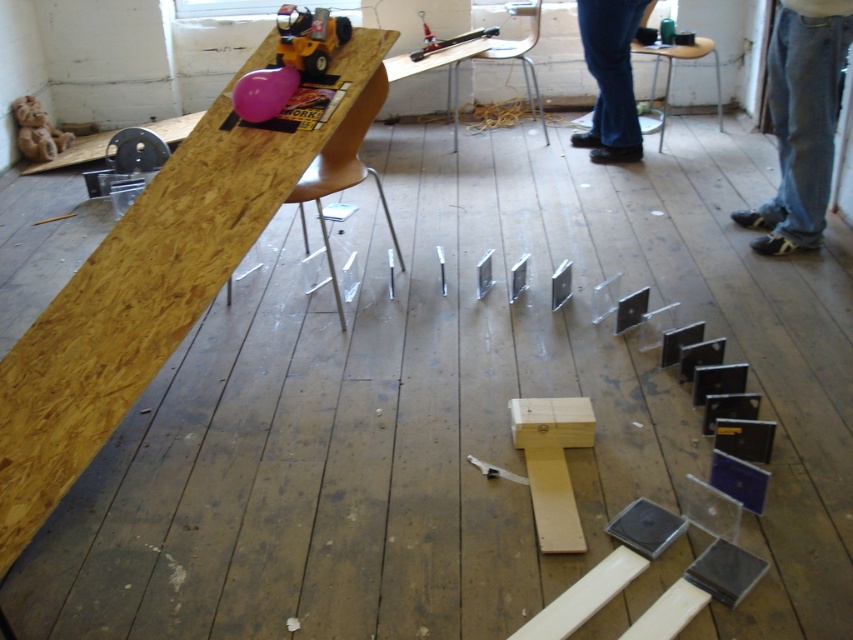
You are organizing items in a workshop and need to place the jeans at lower right and the brown leather stool at upper center. According to the scene, which item is positioned higher up in the image?

The jeans at lower right is located above the brown leather stool at upper center, so the jeans at lower right is positioned higher up in the image.

You are a person who wants to sit on the brown leather stool at upper center. However, there is a clear plastic ruler at upper center in the way. Can you sit down without moving the ruler?

The brown leather stool at upper center is much taller than the clear plastic ruler at upper center, so you can sit down without moving the ruler because the ruler is lower and won